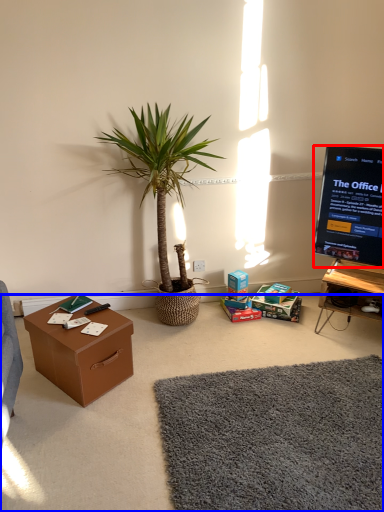
Question: Which point is further to the camera, television (highlighted by a red box) or plain (highlighted by a blue box)?

Choices:
 (A) television
 (B) plain

Answer: (A)